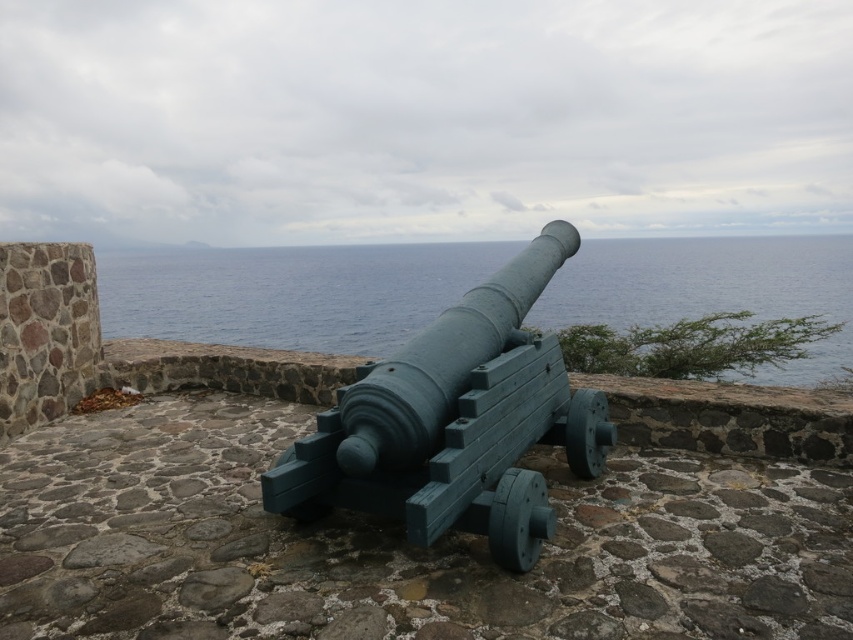
Question: Among these points, which one is farthest from the camera?

Choices:
 (A) (426, 275)
 (B) (477, 426)

Answer: (A)

Question: Does blue water at center have a greater width compared to green painted wood at center?

Choices:
 (A) no
 (B) yes

Answer: (B)

Question: Among these points, which one is farthest from the camera?

Choices:
 (A) (711, 401)
 (B) (184, 330)

Answer: (B)

Question: Does teal painted wood cannon at center have a larger size compared to green painted wood at center?

Choices:
 (A) no
 (B) yes

Answer: (A)

Question: Is green painted wood cannon at center bigger than teal painted wood cannon at center?

Choices:
 (A) no
 (B) yes

Answer: (A)

Question: Which object is closer to the camera taking this photo?

Choices:
 (A) green painted wood at center
 (B) teal painted wood cannon at center
 (C) green painted wood cannon at center

Answer: (C)